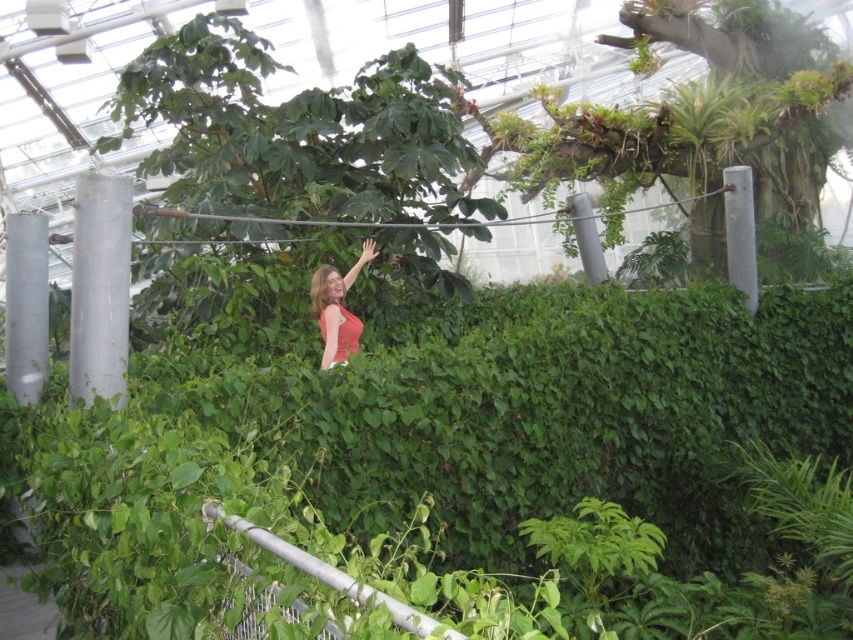
Question: Which point is closer to the camera?

Choices:
 (A) silver metallic rail at center
 (B) matte red dress at center

Answer: (A)

Question: Can you confirm if green leafy hedge at center is smaller than matte red dress at center?

Choices:
 (A) no
 (B) yes

Answer: (A)

Question: Which point is farther from the camera taking this photo?

Choices:
 (A) (331, 320)
 (B) (554, 465)
 (C) (415, 612)

Answer: (A)

Question: From the image, what is the correct spatial relationship of silver metallic rail at center in relation to matte red dress at center?

Choices:
 (A) right
 (B) left

Answer: (A)

Question: Can you confirm if green leafy hedge at center is thinner than matte red dress at center?

Choices:
 (A) yes
 (B) no

Answer: (B)

Question: Estimate the real-world distances between objects in this image. Which object is farther from the green leafy hedge at center?

Choices:
 (A) matte red dress at center
 (B) silver metallic rail at center

Answer: (B)